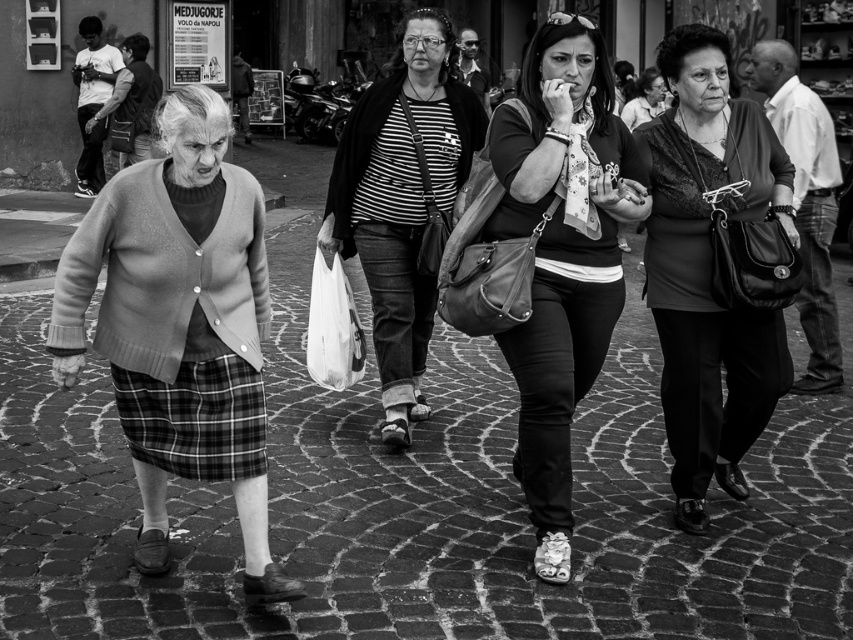
Who is positioned more to the right, leather handbag at center or plaid fabric skirt at lower left?

Positioned to the right is leather handbag at center.

Is leather handbag at center further to the viewer compared to plaid fabric skirt at lower left?

Yes.

Is point (550, 140) in front of point (148, 385)?

No.

You are a GUI agent. You are given a task and a screenshot of the screen. Output one action in this format:
    pyautogui.click(x=<x>, y=<y>)
    Task: Click on the leather handbag at center
    
    Given the screenshot: What is the action you would take?
    pyautogui.click(x=561, y=253)

Does knitted sweater at left appear under leather handbag at center?

Correct, knitted sweater at left is located below leather handbag at center.

Is point (201, 234) in front of point (537, 282)?

Yes, point (201, 234) is in front of point (537, 282).

Is point (149, 166) in front of point (561, 202)?

That is True.

In order to click on knitted sweater at left in this screenshot , I will do `click(180, 324)`.

Is cobblestone pavement at center positioned behind plaid fabric skirt at lower left?

Yes, it is behind plaid fabric skirt at lower left.

Is cobblestone pavement at center to the left of plaid fabric skirt at lower left from the viewer's perspective?

Incorrect, cobblestone pavement at center is not on the left side of plaid fabric skirt at lower left.

Who is more distant from viewer, (842, 468) or (177, 472)?

The point (842, 468) is behind.

You are a GUI agent. You are given a task and a screenshot of the screen. Output one action in this format:
    pyautogui.click(x=<x>, y=<y>)
    Task: Click on the cobblestone pavement at center
    The image size is (853, 640).
    Given the screenshot: What is the action you would take?
    point(415,504)